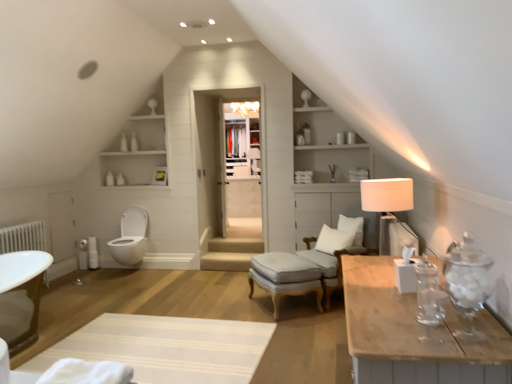
Question: Is light gray fabric stool at center outside of white textured rug at lower center?

Choices:
 (A) no
 (B) yes

Answer: (B)

Question: Is light gray fabric stool at center positioned in front of white textured rug at lower center?

Choices:
 (A) yes
 (B) no

Answer: (B)

Question: Is light gray fabric stool at center not close to white textured rug at lower center?

Choices:
 (A) no
 (B) yes

Answer: (A)

Question: From the image's perspective, is light gray fabric stool at center located beneath white textured rug at lower center?

Choices:
 (A) yes
 (B) no

Answer: (B)

Question: Is light gray fabric stool at center to the right of white textured rug at lower center from the viewer's perspective?

Choices:
 (A) yes
 (B) no

Answer: (A)

Question: Based on their sizes in the image, would you say white soft cushion at center, the first pillow from the bottom, is bigger or smaller than white soft pillow at center, placed as the 2th pillow when sorted from bottom to top?

Choices:
 (A) small
 (B) big

Answer: (B)

Question: Looking at their shapes, would you say white soft cushion at center, which appears as the 2th pillow when viewed from the top, is wider or thinner than white soft pillow at center, placed as the 2th pillow when sorted from bottom to top?

Choices:
 (A) wide
 (B) thin

Answer: (A)

Question: From a real-world perspective, is white soft cushion at center, the first pillow from the bottom, above or below white soft pillow at center, which is the 1th pillow in top-to-bottom order?

Choices:
 (A) above
 (B) below

Answer: (B)

Question: Based on their positions, is white soft cushion at center, which appears as the 2th pillow when viewed from the top, located to the left or right of white soft pillow at center, placed as the 2th pillow when sorted from bottom to top?

Choices:
 (A) left
 (B) right

Answer: (A)

Question: Is light gray fabric stool at center taller or shorter than white soft pillow at center, placed as the 2th pillow when sorted from bottom to top?

Choices:
 (A) short
 (B) tall

Answer: (B)

Question: Is light gray fabric stool at center spatially inside white soft pillow at center, placed as the 2th pillow when sorted from bottom to top, or outside of it?

Choices:
 (A) inside
 (B) outside

Answer: (B)

Question: Considering the positions of light gray fabric stool at center and white soft pillow at center, which is the 1th pillow in top-to-bottom order, in the image, is light gray fabric stool at center bigger or smaller than white soft pillow at center, which is the 1th pillow in top-to-bottom order,?

Choices:
 (A) big
 (B) small

Answer: (A)

Question: Looking at their shapes, would you say light gray fabric stool at center is wider or thinner than white soft pillow at center, which is the 1th pillow in top-to-bottom order?

Choices:
 (A) wide
 (B) thin

Answer: (A)

Question: Would you say clear glass door at center is to the left or to the right of white soft pillow at center, placed as the 2th pillow when sorted from bottom to top, in the picture?

Choices:
 (A) left
 (B) right

Answer: (A)

Question: Which is correct: clear glass door at center is inside white soft pillow at center, placed as the 2th pillow when sorted from bottom to top, or outside of it?

Choices:
 (A) outside
 (B) inside

Answer: (A)